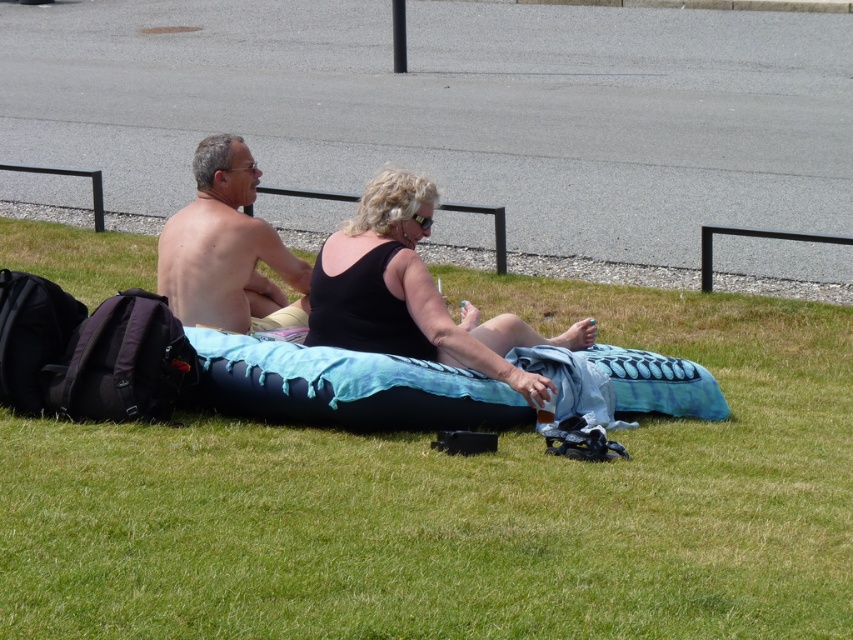
Question: Does green grassy at center appear on the right side of skinny shirtless man at center?

Choices:
 (A) yes
 (B) no

Answer: (A)

Question: Among these points, which one is farthest from the camera?

Choices:
 (A) (270, 246)
 (B) (416, 259)
 (C) (228, 474)

Answer: (A)

Question: Which point is closer to the camera taking this photo?

Choices:
 (A) (532, 625)
 (B) (413, 209)

Answer: (A)

Question: Can you confirm if green grassy at center is positioned to the left of black matte tank top at center?

Choices:
 (A) yes
 (B) no

Answer: (B)

Question: In this image, where is green grassy at center located relative to black matte tank top at center?

Choices:
 (A) right
 (B) left

Answer: (A)

Question: Based on their relative distances, which object is farther from the green grassy at center?

Choices:
 (A) skinny shirtless man at center
 (B) black matte tank top at center

Answer: (A)